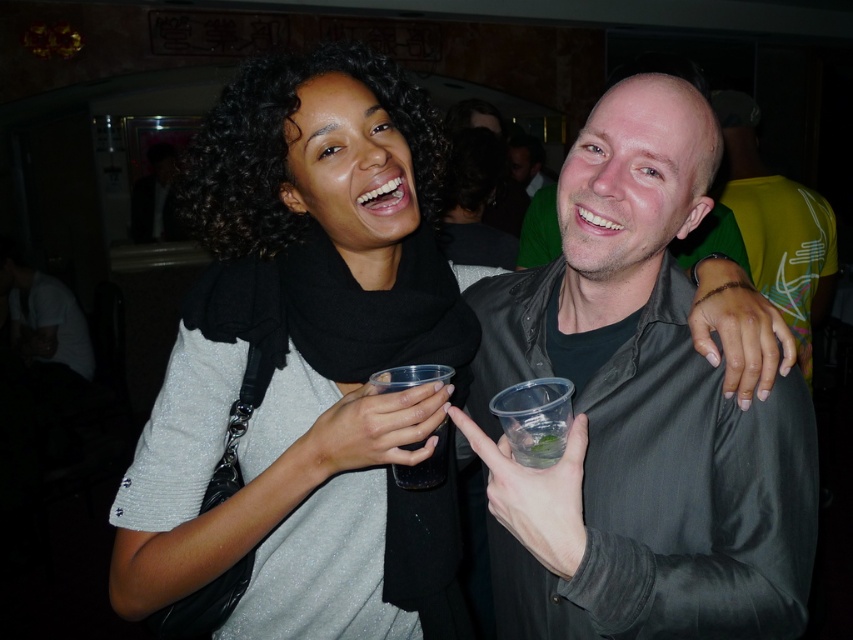
Can you confirm if matte black scarf at center is taller than translucent plastic cup at center?

Yes, matte black scarf at center is taller than translucent plastic cup at center.

Between point (341, 440) and point (440, 433), which one is positioned behind?

The point (440, 433) is behind.

Image resolution: width=853 pixels, height=640 pixels. I want to click on matte black scarf at center, so click(308, 356).

Between point (781, 234) and point (514, 449), which one is positioned behind?

Point (781, 234)

Which is below, green matte shirt at right or clear plastic cup at center?

clear plastic cup at center

At what (x,y) coordinates should I click in order to perform the action: click on green matte shirt at right. Please return your answer as a coordinate pair (x, y). Looking at the image, I should click on (776, 225).

What do you see at coordinates (308, 356) in the screenshot? I see `matte black scarf at center` at bounding box center [308, 356].

Between point (370, 348) and point (618, 332), which one is positioned in front?

Point (618, 332) is more forward.

Is point (386, 292) behind point (567, 570)?

Yes, it is behind point (567, 570).

You are a GUI agent. You are given a task and a screenshot of the screen. Output one action in this format:
    pyautogui.click(x=<x>, y=<y>)
    Task: Click on the matte black scarf at center
    
    Given the screenshot: What is the action you would take?
    pyautogui.click(x=308, y=356)